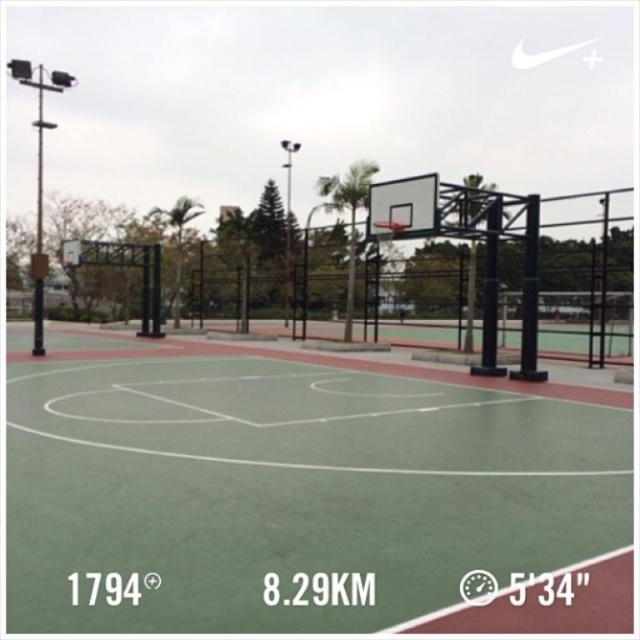
This screenshot has width=640, height=640. What do you see at coordinates (291, 490) in the screenshot?
I see `green rubber basketball court at center` at bounding box center [291, 490].

Is green rubber basketball court at center positioned before metallic silver basketball hoop at center?

Yes, green rubber basketball court at center is in front of metallic silver basketball hoop at center.

This screenshot has height=640, width=640. What do you see at coordinates (291, 490) in the screenshot?
I see `green rubber basketball court at center` at bounding box center [291, 490].

This screenshot has width=640, height=640. I want to click on green rubber basketball court at center, so click(291, 490).